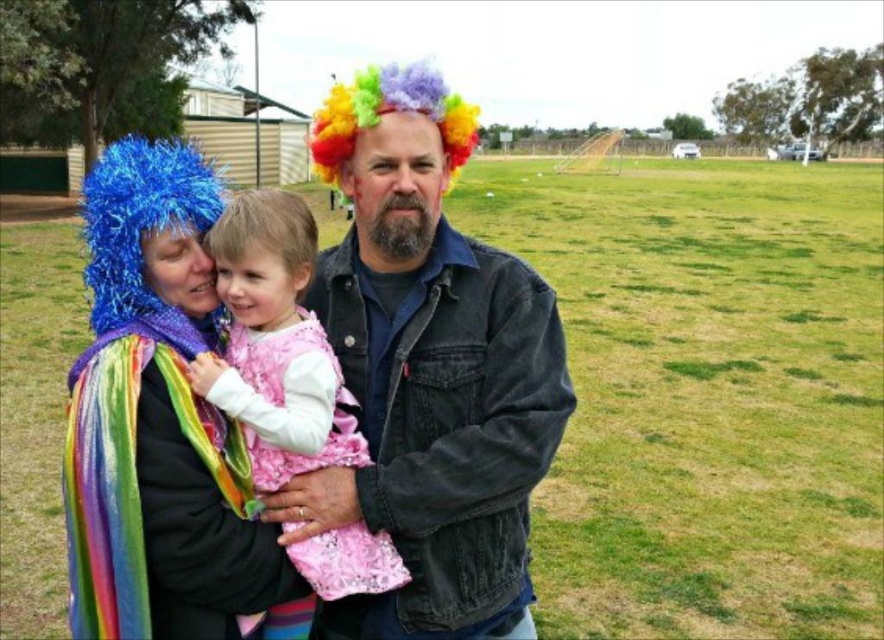
You are a photographer setting up for a group photo. You want to ensure that the denim jacket at center and the pink satin dress at center are both clearly visible in the frame. Based on their heights, which one might you need to adjust the camera angle for to capture both effectively?

The denim jacket at center is shorter than the pink satin dress at center. To capture both effectively, you might need to lower the camera angle slightly to ensure the shorter denim jacket at center is visible without the taller pink satin dress at center blocking it.